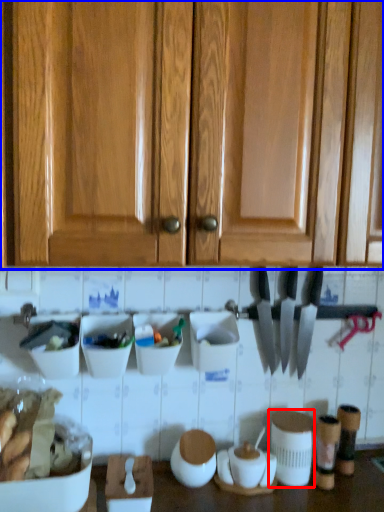
Question: Among these objects, which one is farthest to the camera, appliance (highlighted by a red box) or cabinetry (highlighted by a blue box)?

Choices:
 (A) appliance
 (B) cabinetry

Answer: (A)